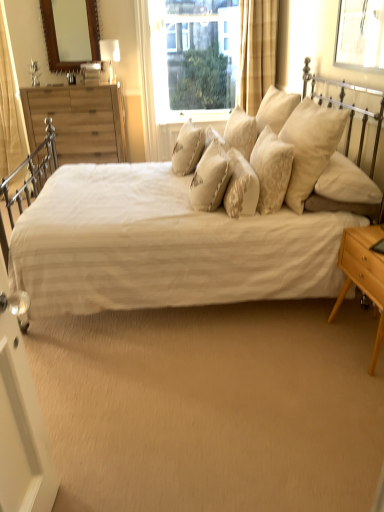
Question: Is transparent plastic window screen at upper right spatially inside beige textured pillow at center, which ranks as the third pillow in left-to-right order, or outside of it?

Choices:
 (A) inside
 (B) outside

Answer: (B)

Question: Considering their positions, is transparent plastic window screen at upper right located in front of or behind beige textured pillow at center, which ranks as the third pillow in left-to-right order?

Choices:
 (A) front
 (B) behind

Answer: (A)

Question: Which object is the closest to the matte white table lamp at upper center?

Choices:
 (A) wooden chest of drawers at left
 (B) beige textured pillow at center, which ranks as the third pillow in left-to-right order
 (C) creamy fabric pillow at center, which is the 5th pillow from left to right
 (D) beige textured pillow at center, the fifth pillow from the right
 (E) clear glass window at upper center

Answer: (A)

Question: Considering the real-world distances, which object is closest to the white textured bed at center?

Choices:
 (A) transparent plastic window screen at upper right
 (B) beige textured pillow at center, acting as the 4th pillow starting from the right
 (C) textured cream pillow at center, arranged as the 1th pillow when viewed from the left
 (D) matte white table lamp at upper center
 (E) soft cream fabric pillows at center, positioned as the first pillow in right-to-left order

Answer: (E)